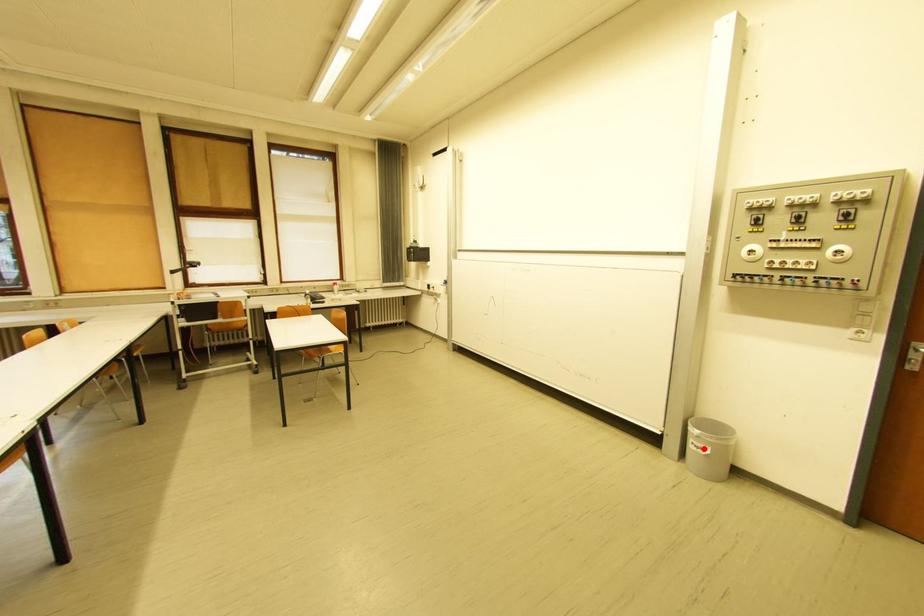
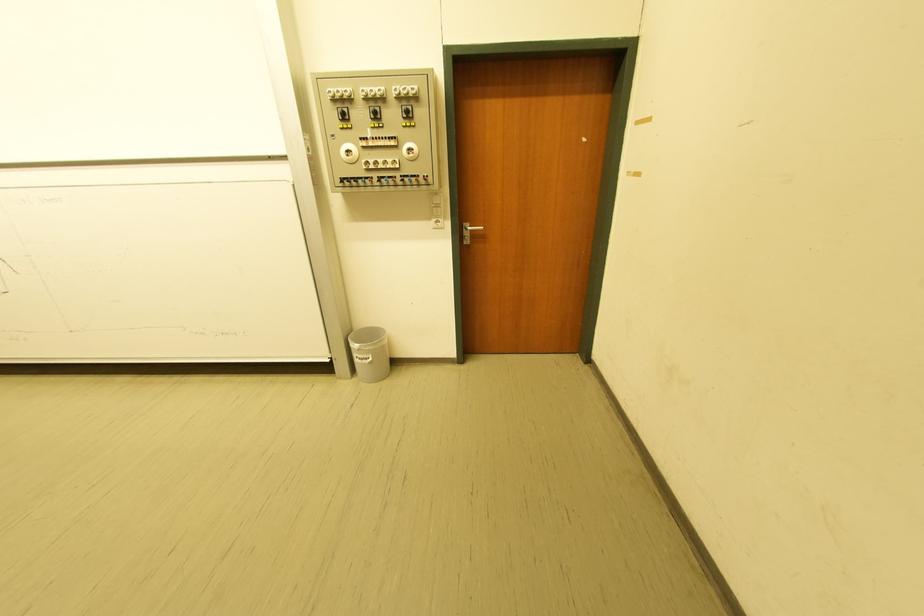
Question: A red point is marked in image1. In image2, is the corresponding 3D point closer to the camera or farther? Reply with the corresponding letter.

Choices:
 (A) The corresponding 3D point is closer.
 (B) The corresponding 3D point is farther.

Answer: (A)